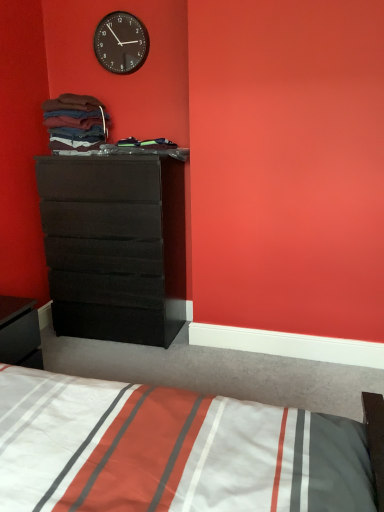
Question: Considering the relative sizes of white striped fabric at lower center and black glossy nightstand at lower left in the image provided, is white striped fabric at lower center thinner than black glossy nightstand at lower left?

Choices:
 (A) no
 (B) yes

Answer: (A)

Question: Does white striped fabric at lower center come in front of black glossy nightstand at lower left?

Choices:
 (A) yes
 (B) no

Answer: (A)

Question: From a real-world perspective, does white striped fabric at lower center sit lower than black glossy nightstand at lower left?

Choices:
 (A) yes
 (B) no

Answer: (A)

Question: Is white striped fabric at lower center further to camera compared to black glossy nightstand at lower left?

Choices:
 (A) no
 (B) yes

Answer: (A)

Question: From the image's perspective, does white striped fabric at lower center appear lower than black glossy nightstand at lower left?

Choices:
 (A) no
 (B) yes

Answer: (B)

Question: Is black glossy nightstand at lower left inside or outside of white striped fabric at lower center?

Choices:
 (A) outside
 (B) inside

Answer: (A)

Question: Based on their sizes in the image, would you say black glossy nightstand at lower left is bigger or smaller than white striped fabric at lower center?

Choices:
 (A) big
 (B) small

Answer: (B)

Question: Based on their positions, is black glossy nightstand at lower left located to the left or right of white striped fabric at lower center?

Choices:
 (A) right
 (B) left

Answer: (B)

Question: Looking at their shapes, would you say black glossy nightstand at lower left is wider or thinner than white striped fabric at lower center?

Choices:
 (A) thin
 (B) wide

Answer: (A)

Question: In terms of width, does white striped fabric at lower center look wider or thinner when compared to black plastic wall clock at upper center?

Choices:
 (A) wide
 (B) thin

Answer: (A)

Question: Does point (342, 501) appear closer or farther from the camera than point (107, 48)?

Choices:
 (A) farther
 (B) closer

Answer: (B)

Question: In the image, is white striped fabric at lower center positioned in front of or behind black plastic wall clock at upper center?

Choices:
 (A) front
 (B) behind

Answer: (A)

Question: In terms of height, does white striped fabric at lower center look taller or shorter compared to black plastic wall clock at upper center?

Choices:
 (A) short
 (B) tall

Answer: (A)

Question: From a real-world perspective, relative to white striped fabric at lower center, is matte black dresser at left vertically above or below?

Choices:
 (A) below
 (B) above

Answer: (B)

Question: Choose the correct answer: Is matte black dresser at left inside white striped fabric at lower center or outside it?

Choices:
 (A) inside
 (B) outside

Answer: (B)